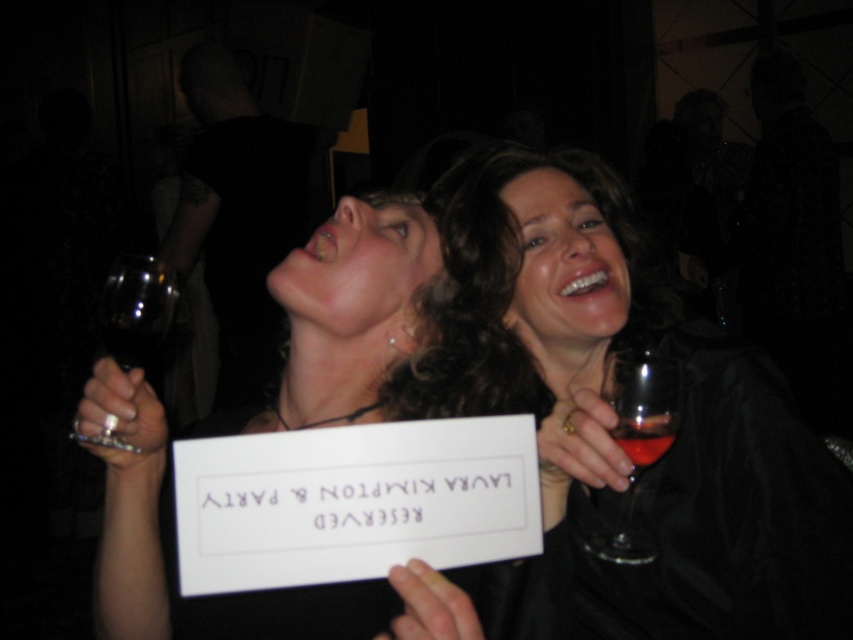
Question: Which of the following is the farthest from the observer?

Choices:
 (A) matte white sign at center
 (B) transparent glass at left

Answer: (B)

Question: Can you confirm if translucent glass at upper center is wider than transparent glass at upper left?

Choices:
 (A) no
 (B) yes

Answer: (A)

Question: Which point appears farthest from the camera in this image?

Choices:
 (A) (102, 436)
 (B) (115, 522)
 (C) (123, 349)
 (D) (648, 349)

Answer: (D)

Question: Which object appears closest to the camera in this image?

Choices:
 (A) translucent glass at upper center
 (B) transparent glass at left
 (C) transparent glass at upper left

Answer: (A)

Question: Can you confirm if matte black wine glass at upper right is positioned to the right of translucent glass at upper center?

Choices:
 (A) no
 (B) yes

Answer: (B)

Question: Can you confirm if matte black wine glass at upper right is wider than transparent glass at left?

Choices:
 (A) yes
 (B) no

Answer: (A)